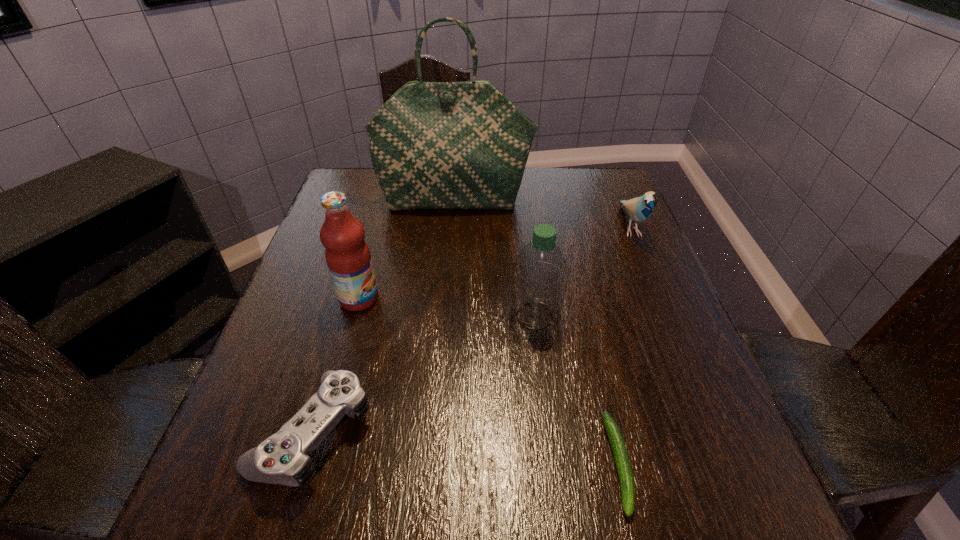
Find the location of a particular element. The image size is (960, 540). object that is at the right edge is located at coordinates (639, 209).

I want to click on object at the far left corner, so click(x=434, y=145).

Find the location of `object located in the near left corner section of the desktop`. object located in the near left corner section of the desktop is located at coordinates (283, 458).

At what (x,y) coordinates should I click in order to perform the action: click on object that is positioned at the far right corner. Please return your answer as a coordinate pair (x, y). The height and width of the screenshot is (540, 960). Looking at the image, I should click on (639, 209).

In the image, there is a desktop. Where is `vacant space at the near edge`? Image resolution: width=960 pixels, height=540 pixels. vacant space at the near edge is located at coordinates (526, 517).

The image size is (960, 540). Identify the location of free spot at the left edge of the desktop. (232, 429).

In the image, there is a desktop. Where is `free space at the right edge`? free space at the right edge is located at coordinates (622, 249).

The image size is (960, 540). Identify the location of free space at the near left corner. (271, 539).

You are a GUI agent. You are given a task and a screenshot of the screen. Output one action in this format:
    pyautogui.click(x=<x>, y=<y>)
    Task: Click on the vacant space at the far right corner of the desktop
    Image resolution: width=960 pixels, height=540 pixels.
    Given the screenshot: What is the action you would take?
    pyautogui.click(x=590, y=183)

Find the location of a particular element. This screenshot has width=960, height=540. vacant area that lies between the control and the shortest object is located at coordinates (467, 447).